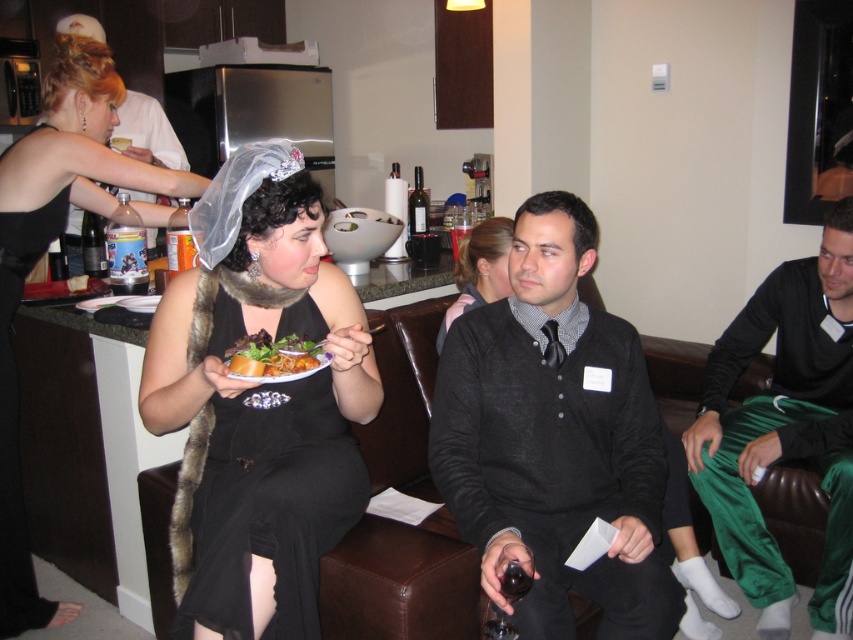
Is point (323, 550) farther from camera compared to point (554, 264)?

No, it is not.

Is black fur stole at center above dark gray sweater at center?

Correct, black fur stole at center is located above dark gray sweater at center.

Is point (302, 307) positioned behind point (483, 529)?

Yes.

Where is `black fur stole at center`? Image resolution: width=853 pixels, height=640 pixels. black fur stole at center is located at coordinates (258, 403).

Can you confirm if dark gray sweater at center is bigger than matte black plate with salad and sandwich at center?

Yes.

Between point (613, 604) and point (281, 369), which one is positioned in front?

Point (281, 369) is more forward.

This screenshot has height=640, width=853. What are the coordinates of `dark gray sweater at center` in the screenshot? It's located at 555,436.

At what (x,y) coordinates should I click in order to perform the action: click on dark gray sweater at center. Please return your answer as a coordinate pair (x, y). The width and height of the screenshot is (853, 640). Looking at the image, I should click on (555, 436).

Can you confirm if dark gray sweater at center is positioned to the left of velvet green track pants at lower right?

Correct, you'll find dark gray sweater at center to the left of velvet green track pants at lower right.

Who is more forward, (514,620) or (828,412)?

Point (514,620)

Locate an element on the screen. The height and width of the screenshot is (640, 853). dark gray sweater at center is located at coordinates (555, 436).